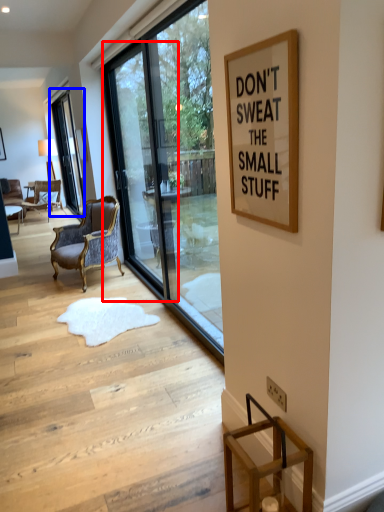
Question: Which object appears closest to the camera in this image, screen door (highlighted by a red box) or window (highlighted by a blue box)?

Choices:
 (A) screen door
 (B) window

Answer: (A)